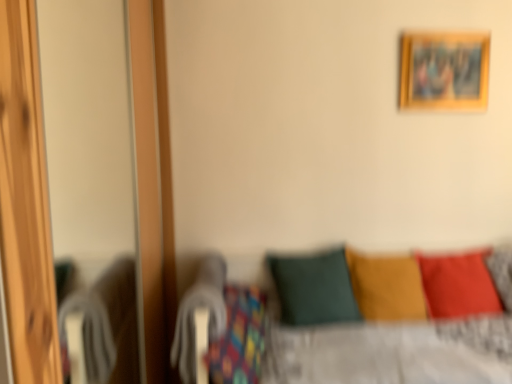
Question: Considering the relative sizes of wooden picture frame at upper right and matte red pillow at lower right, positioned as the 3th pillow in left-to-right order, in the image provided, is wooden picture frame at upper right taller than matte red pillow at lower right, positioned as the 3th pillow in left-to-right order,?

Choices:
 (A) yes
 (B) no

Answer: (B)

Question: Is wooden picture frame at upper right not inside matte red pillow at lower right, which appears as the 1th pillow when viewed from the right?

Choices:
 (A) no
 (B) yes

Answer: (B)

Question: Does wooden picture frame at upper right have a lesser width compared to matte red pillow at lower right, which appears as the 1th pillow when viewed from the right?

Choices:
 (A) yes
 (B) no

Answer: (A)

Question: Is wooden picture frame at upper right smaller than matte red pillow at lower right, which appears as the 1th pillow when viewed from the right?

Choices:
 (A) yes
 (B) no

Answer: (A)

Question: Can you confirm if wooden picture frame at upper right is bigger than matte red pillow at lower right, positioned as the 3th pillow in left-to-right order?

Choices:
 (A) yes
 (B) no

Answer: (B)

Question: Considering the relative positions of wooden picture frame at upper right and matte red pillow at lower right, positioned as the 3th pillow in left-to-right order, in the image provided, is wooden picture frame at upper right to the left of matte red pillow at lower right, positioned as the 3th pillow in left-to-right order, from the viewer's perspective?

Choices:
 (A) yes
 (B) no

Answer: (A)

Question: Is dark green fabric pillow at center, marked as the 1th pillow in a left-to-right arrangement, shorter than wooden screen door at left?

Choices:
 (A) no
 (B) yes

Answer: (B)

Question: Is dark green fabric pillow at center, placed as the 3th pillow when sorted from right to left, taller than wooden screen door at left?

Choices:
 (A) yes
 (B) no

Answer: (B)

Question: Is wooden screen door at left inside dark green fabric pillow at center, placed as the 3th pillow when sorted from right to left?

Choices:
 (A) yes
 (B) no

Answer: (B)

Question: Does dark green fabric pillow at center, marked as the 1th pillow in a left-to-right arrangement, have a smaller size compared to wooden screen door at left?

Choices:
 (A) yes
 (B) no

Answer: (A)

Question: Considering the relative positions of dark green fabric pillow at center, marked as the 1th pillow in a left-to-right arrangement, and wooden screen door at left in the image provided, is dark green fabric pillow at center, marked as the 1th pillow in a left-to-right arrangement, to the right of wooden screen door at left from the viewer's perspective?

Choices:
 (A) yes
 (B) no

Answer: (A)

Question: Is dark green fabric pillow at center, placed as the 3th pillow when sorted from right to left, looking in the opposite direction of wooden screen door at left?

Choices:
 (A) no
 (B) yes

Answer: (A)

Question: Considering the relative sizes of wooden screen door at left and velvet yellow pillow at center, which is the second pillow in right-to-left order, in the image provided, is wooden screen door at left thinner than velvet yellow pillow at center, which is the second pillow in right-to-left order,?

Choices:
 (A) yes
 (B) no

Answer: (B)